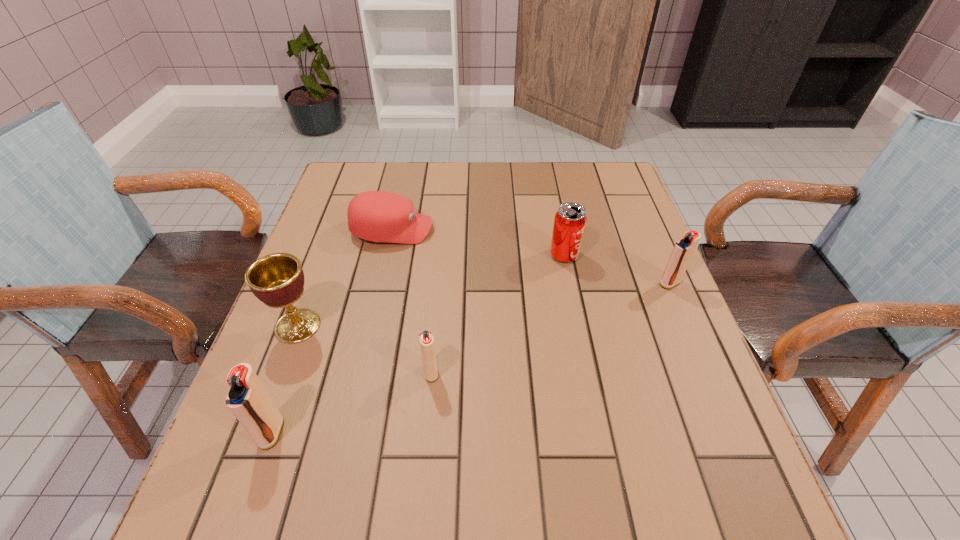
You are a GUI agent. You are given a task and a screenshot of the screen. Output one action in this format:
    pyautogui.click(x=<x>, y=<y>)
    Task: Click on the igniter that is the third closest to the fourth farthest object
    The image size is (960, 540).
    Given the screenshot: What is the action you would take?
    pyautogui.click(x=682, y=253)

The width and height of the screenshot is (960, 540). In order to click on vacant region that satisfies the following two spatial constraints: 1. on the back side of the fourth farthest object; 2. on the left side of the second tallest igniter in this screenshot , I will do `click(314, 283)`.

Identify the location of free space in the image that satisfies the following two spatial constraints: 1. on the back side of the chalice; 2. on the right side of the soda can. (324, 255).

What are the coordinates of `vacant space that satisfies the following two spatial constraints: 1. on the back side of the soda can; 2. on the front-facing side of the shortest object` in the screenshot? It's located at (560, 230).

I want to click on vacant area in the image that satisfies the following two spatial constraints: 1. on the front-facing side of the shortest object; 2. on the left side of the second tallest igniter, so click(380, 283).

Identify the location of vacant point that satisfies the following two spatial constraints: 1. on the back side of the nearest igniter; 2. on the left side of the fifth tallest object. This screenshot has width=960, height=540. (292, 373).